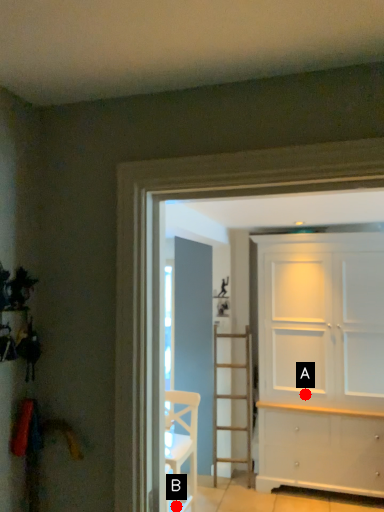
Question: Two points are circled on the image, labeled by A and B beside each circle. Which point is farther to the camera?

Choices:
 (A) A is further
 (B) B is further

Answer: (A)